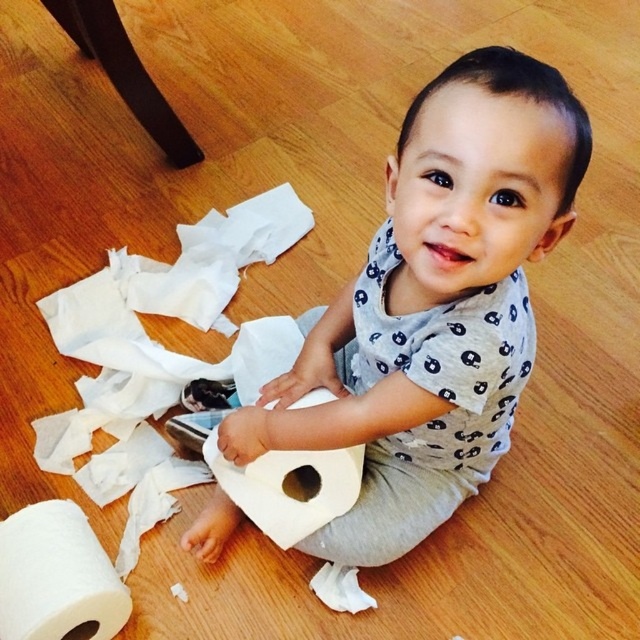
From the picture: Which is above, white matte paper towel at center or white matte paper towel at lower left?

Positioned higher is white matte paper towel at center.

What do you see at coordinates (435, 305) in the screenshot? The image size is (640, 640). I see `white matte paper towel at center` at bounding box center [435, 305].

This screenshot has height=640, width=640. I want to click on white matte paper towel at center, so click(x=435, y=305).

Is the position of white matte paper towel at lower left less distant than that of white paper at center?

Yes.

Does white matte paper towel at lower left have a greater width compared to white paper at center?

No, white matte paper towel at lower left is not wider than white paper at center.

Is point (22, 547) more distant than point (300, 452)?

No.

Where is `white matte paper towel at lower left`? Image resolution: width=640 pixels, height=640 pixels. white matte paper towel at lower left is located at coordinates (56, 576).

Who is positioned more to the right, white matte paper towel at center or white paper at center?

white matte paper towel at center is more to the right.

Between point (563, 120) and point (298, 401), which one is positioned in front?

Point (563, 120)

The image size is (640, 640). Identify the location of white matte paper towel at center. pos(435,305).